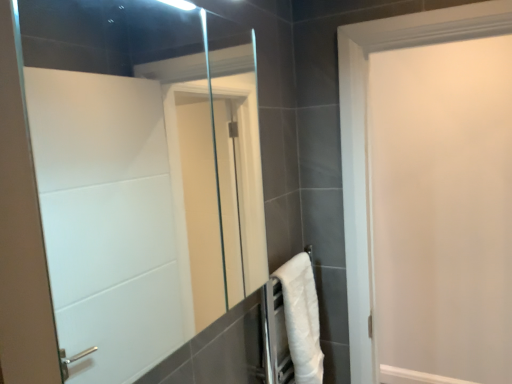
Locate an element on the screen. The width and height of the screenshot is (512, 384). clear glass mirror at center is located at coordinates (141, 174).

At what (x,y) coordinates should I click in order to perform the action: click on white matte door at upper right. Please return your answer as a coordinate pair (x, y). This screenshot has width=512, height=384. Looking at the image, I should click on (441, 211).

Identify the location of clear glass mirror at center. (141, 174).

Can you confirm if white soft towel at lower right is positioned to the right of white matte door at upper right?

Incorrect, white soft towel at lower right is not on the right side of white matte door at upper right.

In terms of height, does white soft towel at lower right look taller or shorter compared to white matte door at upper right?

white soft towel at lower right is shorter than white matte door at upper right.

In the scene shown: Is white soft towel at lower right not close to white matte door at upper right?

Answer: That's right, there is a large distance between white soft towel at lower right and white matte door at upper right.

Is white soft towel at lower right oriented towards white matte door at upper right?

No.

How much distance is there between white matte door at upper right and white soft towel at lower right?

They are 1.46 meters apart.

Which of these two, white matte door at upper right or white soft towel at lower right, is thinner?

white soft towel at lower right.

From the image's perspective, relative to white soft towel at lower right, is white matte door at upper right above or below?

From the image's perspective, white matte door at upper right appears above white soft towel at lower right.

Identify the location of bath towel below the white matte door at upper right (from a real-world perspective). The height and width of the screenshot is (384, 512). (302, 318).

Which object is positioned more to the left, white soft towel at lower right or clear glass mirror at center?

clear glass mirror at center.

Which is in front, point (282, 277) or point (151, 256)?

The point (282, 277) is more forward.

Between white soft towel at lower right and clear glass mirror at center, which one has smaller size?

white soft towel at lower right is smaller.

From the image's perspective, is clear glass mirror at center located above white matte door at upper right?

Yes, from the image's perspective, clear glass mirror at center is over white matte door at upper right.

Where is `mirror on the left of white matte door at upper right`? mirror on the left of white matte door at upper right is located at coordinates (141, 174).

Looking at this image, is clear glass mirror at center directly adjacent to white matte door at upper right?

No.

Which of these two, clear glass mirror at center or white matte door at upper right, is smaller?

clear glass mirror at center is smaller.

Is point (91, 127) closer to camera compared to point (304, 357)?

No.

Which is more to the right, clear glass mirror at center or white soft towel at lower right?

From the viewer's perspective, white soft towel at lower right appears more on the right side.

Is there a large distance between white matte door at upper right and clear glass mirror at center?

Absolutely, white matte door at upper right is distant from clear glass mirror at center.

Is white matte door at upper right looking in the opposite direction of clear glass mirror at center?

That's not correct — white matte door at upper right is not looking away from clear glass mirror at center.

Is point (480, 168) positioned behind point (210, 295)?

That is False.

Which of these two, white matte door at upper right or clear glass mirror at center, is smaller?

With smaller size is clear glass mirror at center.

This screenshot has width=512, height=384. I want to click on bath towel below the white matte door at upper right (from the image's perspective), so click(302, 318).

Locate an element on the screen. This screenshot has width=512, height=384. door that appears on the right of white soft towel at lower right is located at coordinates (441, 211).

Looking at the image, which one is located further to white matte door at upper right, clear glass mirror at center or white soft towel at lower right?

clear glass mirror at center.

When comparing their distances from white soft towel at lower right, does clear glass mirror at center or white matte door at upper right seem further?

white matte door at upper right.

Considering their positions, is white matte door at upper right positioned further to clear glass mirror at center than white soft towel at lower right?

white matte door at upper right.

Based on their spatial positions, is white soft towel at lower right or clear glass mirror at center closer to white matte door at upper right?

white soft towel at lower right is positioned closer to the anchor white matte door at upper right.

From the image, which object appears to be farther from white soft towel at lower right, white matte door at upper right or clear glass mirror at center?

Among the two, white matte door at upper right is located further to white soft towel at lower right.

Looking at the image, which one is located closer to clear glass mirror at center, white soft towel at lower right or white matte door at upper right?

white soft towel at lower right.

Where is `door between clear glass mirror at center and white soft towel at lower right from front to back`? The image size is (512, 384). door between clear glass mirror at center and white soft towel at lower right from front to back is located at coordinates pos(441,211).